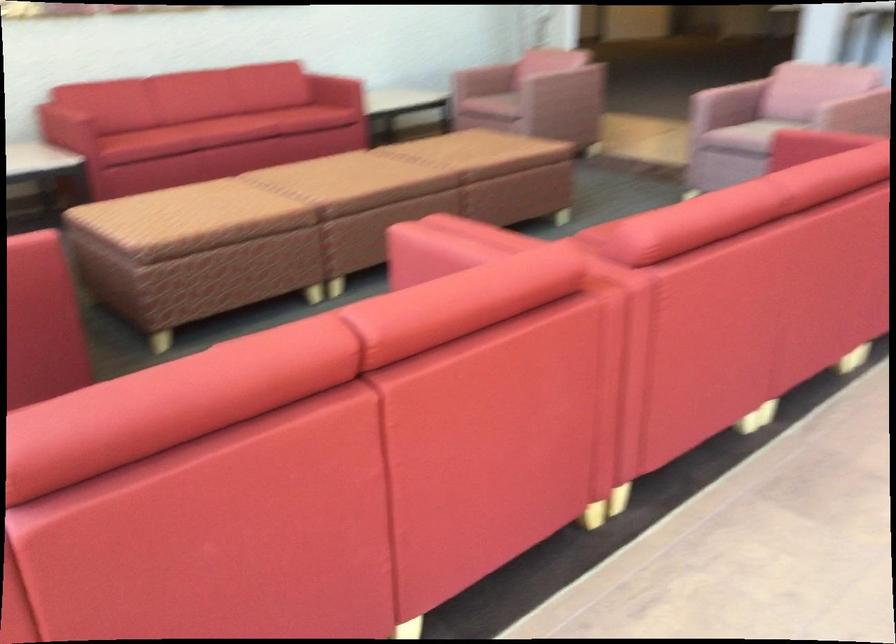
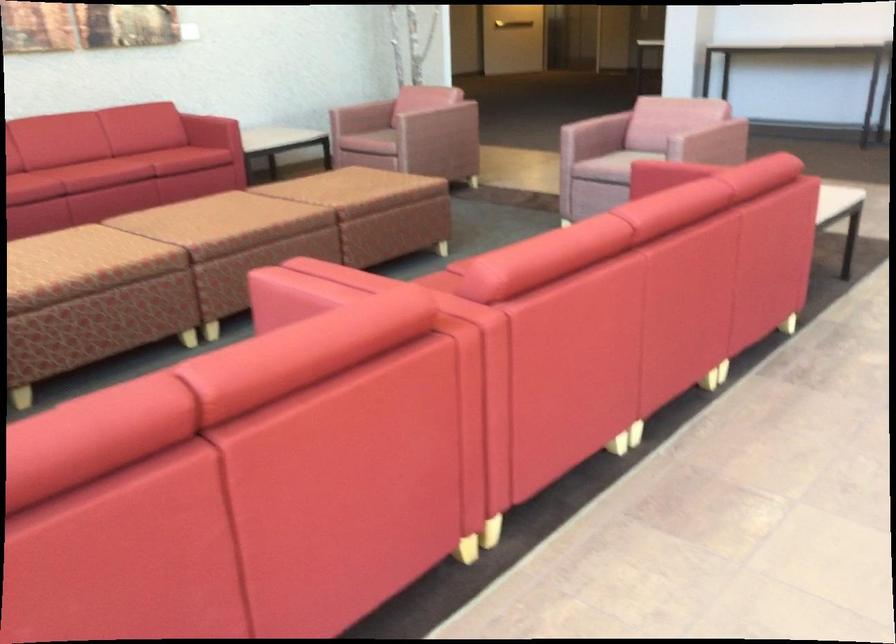
Where in the second image is the point corresponding to pixel 270 120 from the first image?

(142, 162)